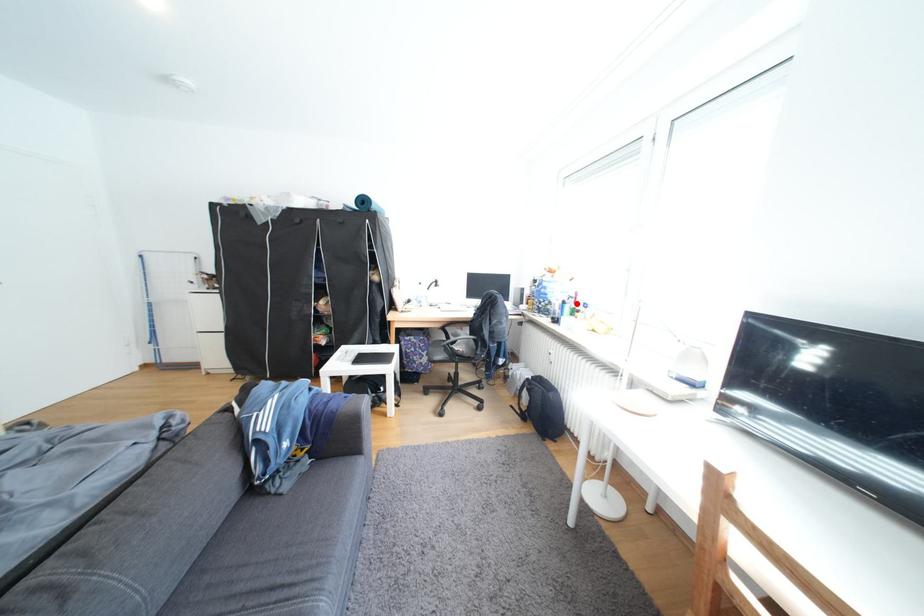
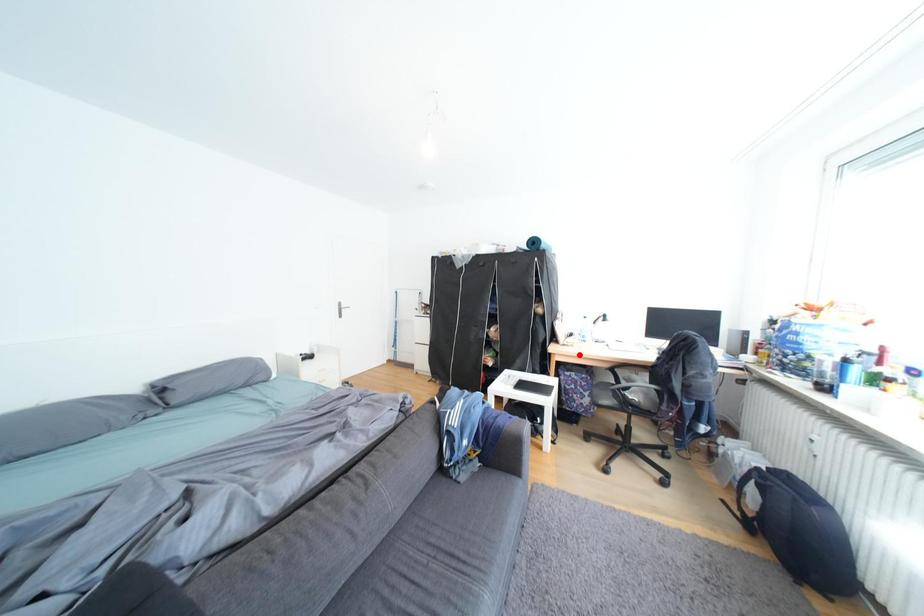
I am providing you with two images of the same scene from different viewpoints. A red point is marked on the first image and another point is marked on the second image. Does the point marked in image1 correspond to the same location as the one in image2?

No